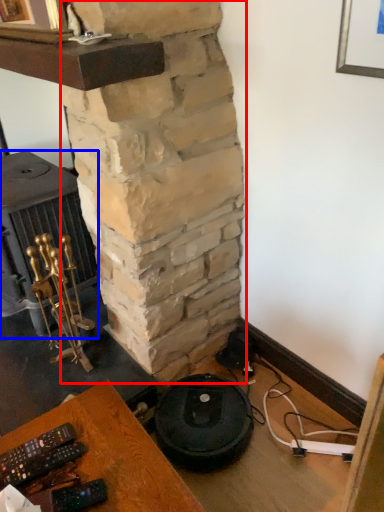
Question: Which point is closer to the camera, pillar (highlighted by a red box) or stove (highlighted by a blue box)?

Choices:
 (A) pillar
 (B) stove

Answer: (A)